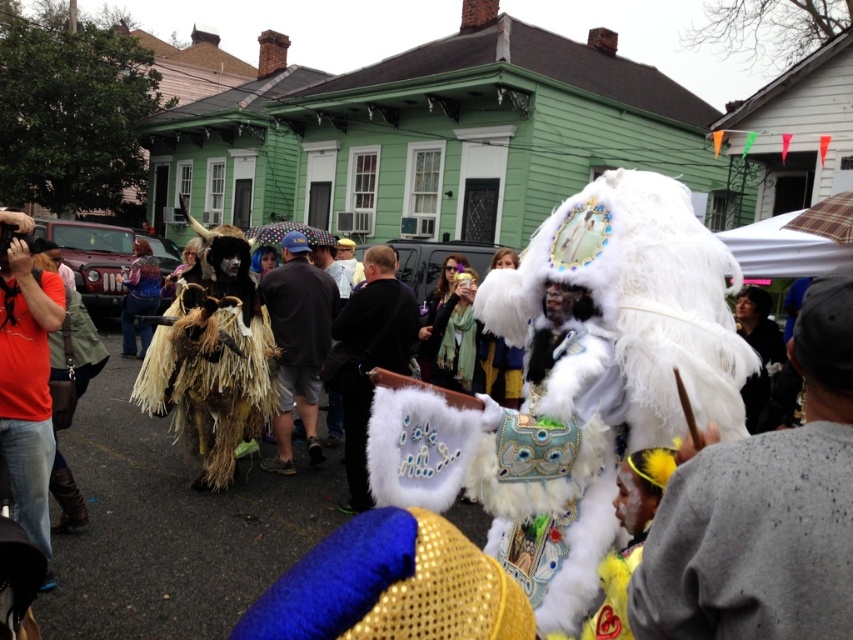
You are a photographer trying to capture a clear photo of the white fluffy headdress at center and the brown straw costume at center. Since you want both to be in focus, which object should you position closer to the camera to ensure depth of field?

The white fluffy headdress at center is thinner than the brown straw costume at center. To ensure both are in focus, position the thinner white fluffy headdress at center closer to the camera because it requires less depth of field compared to the wider brown straw costume at center.

Based on the photo, you are a photographer standing at the center of the street. You want to take a photo that includes both the white fluffy headdress at center and the brown straw costume at center. What is the minimum distance you need to move backward to ensure both objects are in frame?

The white fluffy headdress at center is 5.53 meters from the brown straw costume at center. To include both in the photo, you need to move backward until you are at least 5.53 meters away from the closer object, ensuring both are within the camera frame.